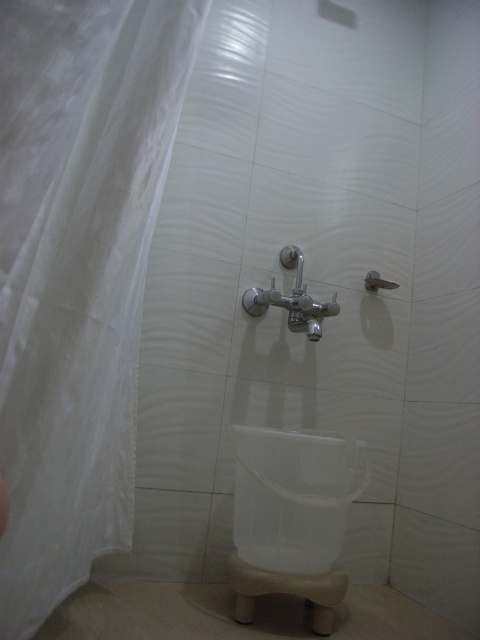
Can you confirm if white sheer curtain at left is thinner than satin nickel faucet at center?

In fact, white sheer curtain at left might be wider than satin nickel faucet at center.

Is point (8, 205) more distant than point (291, 330)?

No, it is not.

Locate an element on the screen. The image size is (480, 640). white sheer curtain at left is located at coordinates (76, 273).

Who is positioned more to the right, satin nickel faucet at center or matte silver shower at upper center?

matte silver shower at upper center is more to the right.

Who is more distant from viewer, (248,289) or (372,280)?

Positioned behind is point (372,280).

Where is `satin nickel faucet at center`? This screenshot has height=640, width=480. satin nickel faucet at center is located at coordinates (291, 298).

Which is in front, point (126, 289) or point (365, 288)?

Point (126, 289) is more forward.

Who is taller, white sheer curtain at left or matte silver shower at upper center?

With more height is white sheer curtain at left.

Does point (20, 534) come closer to viewer compared to point (363, 280)?

Yes.

I want to click on white sheer curtain at left, so click(76, 273).